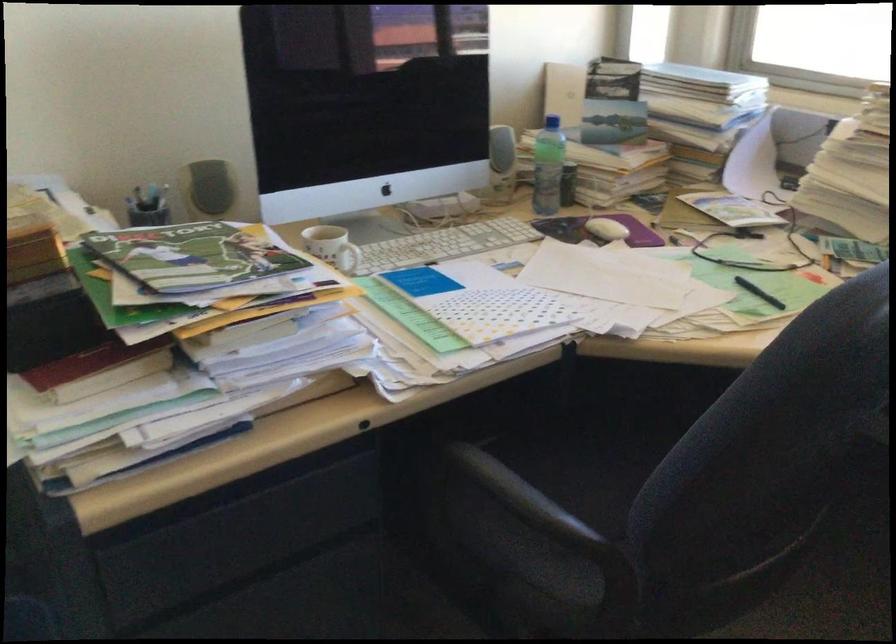
Identify the location of black chair sitting surface. (616, 478).